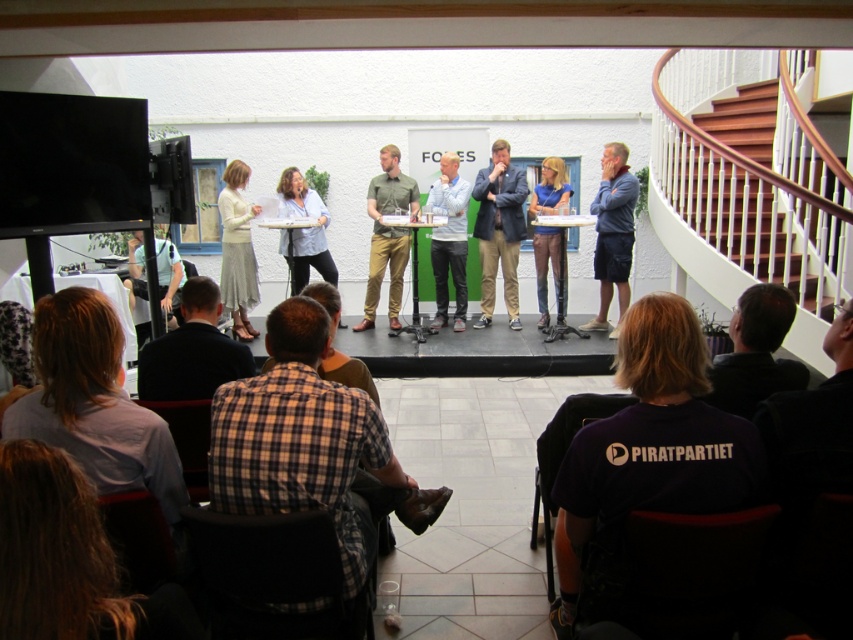
Question: Which object appears closest to the camera in this image?

Choices:
 (A) blue denim shorts at right
 (B) matte blue shirt at center

Answer: (A)

Question: Which point appears farthest from the camera in this image?

Choices:
 (A) (456, 186)
 (B) (314, 212)
 (C) (254, 275)

Answer: (C)

Question: Does purple cotton shirt at lower right appear on the left side of light blue shirt at center?

Choices:
 (A) no
 (B) yes

Answer: (A)

Question: Where is matte blue shirt at center located in relation to blue denim jeans at center in the image?

Choices:
 (A) below
 (B) above

Answer: (B)

Question: Can you confirm if plaid shirt at center is positioned below dark blue shirt at lower left?

Choices:
 (A) yes
 (B) no

Answer: (A)

Question: Considering the real-world distances, which object is closest to the light blue shirt at center?

Choices:
 (A) dark brown leather jacket at lower right
 (B) light blue shirt at lower left
 (C) green cotton shirt at center
 (D) wooden stairs at upper right

Answer: (C)